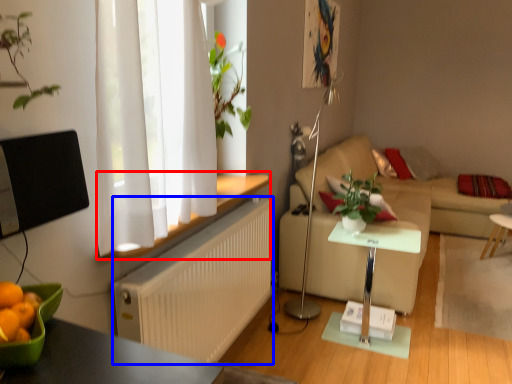
Question: Which object is further to the camera taking this photo, window sill (highlighted by a red box) or radiator (highlighted by a blue box)?

Choices:
 (A) window sill
 (B) radiator

Answer: (B)